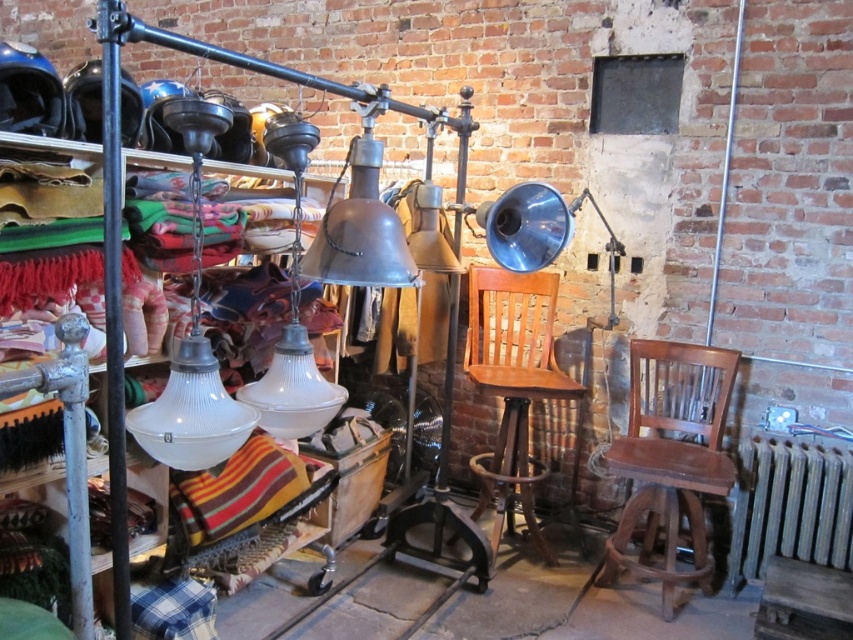
Question: Which point is farther from the camera taking this photo?

Choices:
 (A) (196, 332)
 (B) (531, 330)
 (C) (743, 438)
 (D) (345, 256)

Answer: (B)

Question: Which point is closer to the camera?

Choices:
 (A) (113, 35)
 (B) (641, 554)
 (C) (552, 362)

Answer: (A)

Question: Observing the image, what is the correct spatial positioning of wooden chair at right in reference to polished metal pole at left?

Choices:
 (A) left
 (B) right

Answer: (B)

Question: Which object appears farthest from the camera in this image?

Choices:
 (A) white glass lamp at lower left
 (B) white frosted glass lampshade at center
 (C) polished metal pole at left
 (D) wooden chair at center

Answer: (D)

Question: From the image, what is the correct spatial relationship of white glass lamp at lower left in relation to metallic bell-shaped lamp at center?

Choices:
 (A) left
 (B) right

Answer: (A)

Question: Is white glass lamp at lower left below polished metal pole at left?

Choices:
 (A) no
 (B) yes

Answer: (A)